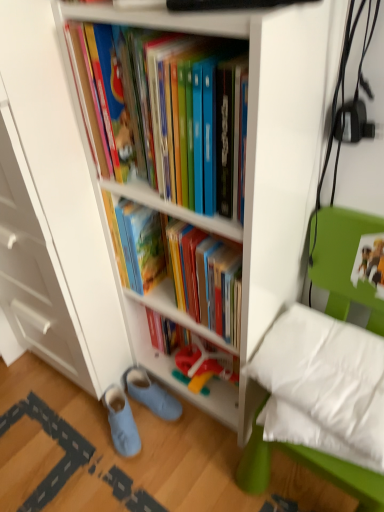
This screenshot has height=512, width=384. What are the coordinates of `vacant region in front of light blue fabric slippers at lower left, placed as the 1th footwear when sorted from left to right` in the screenshot? It's located at (119, 482).